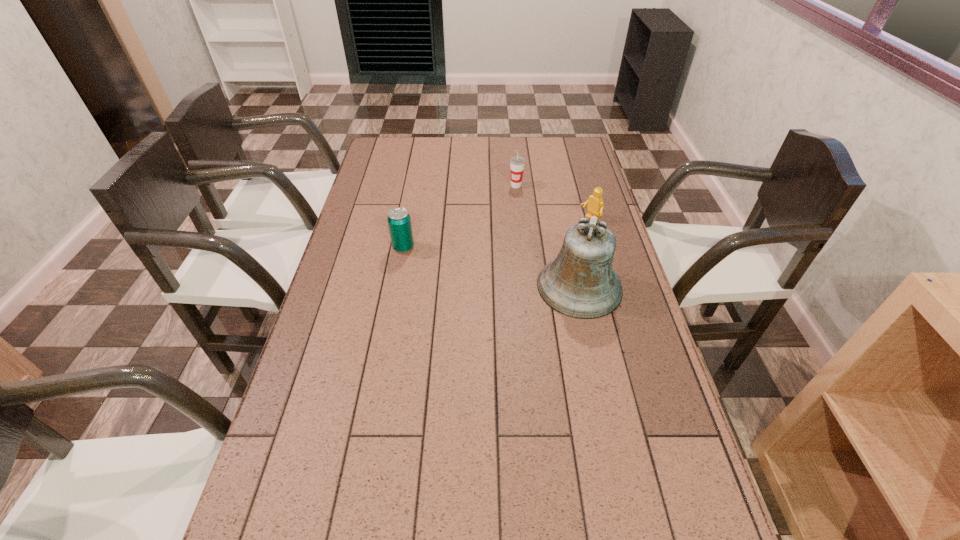
This screenshot has height=540, width=960. I want to click on free space located 0.340m on the side of the farthest object with the logo, so click(513, 248).

Find the location of `free location located on the side of the farthest object with the logo`. free location located on the side of the farthest object with the logo is located at coordinates (514, 227).

In order to click on vacant position located 0.380m on the face of the third nearest object in this screenshot , I will do `click(504, 274)`.

What are the coordinates of `free region located 0.070m on the face of the third nearest object` in the screenshot? It's located at (570, 232).

At what (x,y) coordinates should I click in order to perform the action: click on vacant area located on the face of the third nearest object. Please return your answer as a coordinate pair (x, y). Looking at the image, I should click on (563, 237).

The image size is (960, 540). Find the location of `bell located in the right edge section of the desktop`. bell located in the right edge section of the desktop is located at coordinates (580, 283).

Identify the location of Lego at the right edge. The width and height of the screenshot is (960, 540). (595, 206).

Where is `free point at the far edge`? This screenshot has width=960, height=540. free point at the far edge is located at coordinates (446, 157).

At what (x,y) coordinates should I click in order to perform the action: click on vacant region at the near edge. Please return your answer as a coordinate pair (x, y). Looking at the image, I should click on pos(563,524).

The height and width of the screenshot is (540, 960). I want to click on free location at the left edge, so click(297, 388).